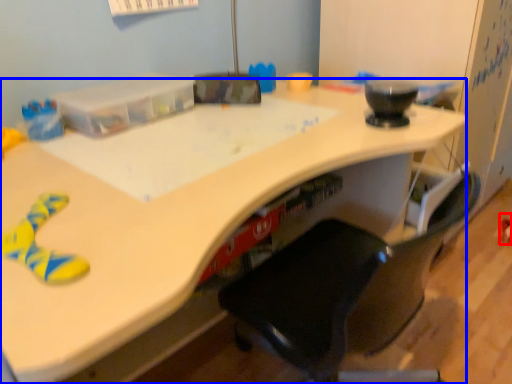
Question: Which object is further to the camera taking this photo, toy (highlighted by a red box) or desk (highlighted by a blue box)?

Choices:
 (A) toy
 (B) desk

Answer: (A)